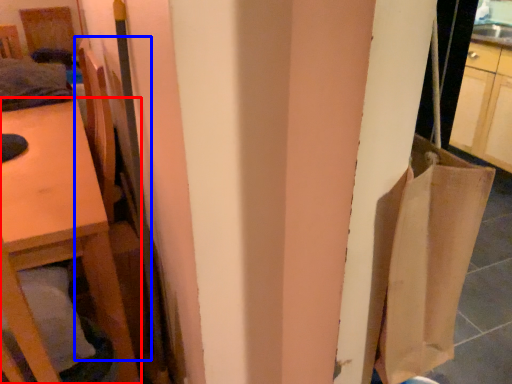
Question: Which of the following is the closest to the observer, furniture (highlighted by a red box) or chair (highlighted by a blue box)?

Choices:
 (A) furniture
 (B) chair

Answer: (B)